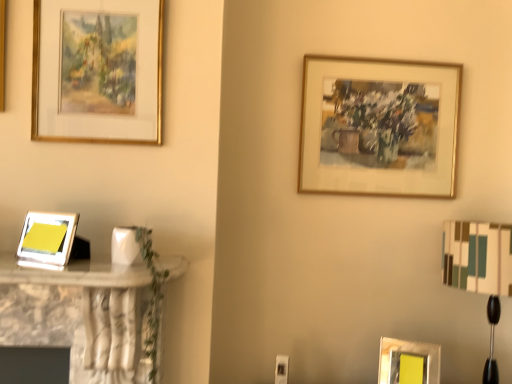
Question: Is gold metallic picture frame at upper right, the third picture frame from the bottom, outside of gold-framed painting at upper left, which appears as the second picture frame when viewed from the front?

Choices:
 (A) no
 (B) yes

Answer: (B)

Question: Is gold metallic picture frame at upper right, which is the 1th picture frame from back to front, aimed at gold-framed painting at upper left, which appears as the second picture frame when viewed from the front?

Choices:
 (A) yes
 (B) no

Answer: (B)

Question: Is gold metallic picture frame at upper right, the 3th picture frame viewed from the left, next to gold-framed painting at upper left, which appears as the second picture frame when viewed from the front?

Choices:
 (A) yes
 (B) no

Answer: (B)

Question: Is gold-framed painting at upper left, marked as the third picture frame in a back-to-front arrangement, completely or partially inside gold metallic picture frame at upper right, the 3th picture frame viewed from the left?

Choices:
 (A) no
 (B) yes

Answer: (A)

Question: Can you confirm if gold metallic picture frame at upper right, the third picture frame from the bottom, is thinner than gold-framed painting at upper left, the second picture frame viewed from the left?

Choices:
 (A) yes
 (B) no

Answer: (B)

Question: Visually, is matte silver picture frame at lower right, placed as the 1th picture frame when sorted from right to left, positioned to the left or to the right of matte silver picture frame at left, which appears as the fourth picture frame when viewed from the back?

Choices:
 (A) right
 (B) left

Answer: (A)

Question: Do you think matte silver picture frame at lower right, the third picture frame positioned from the front, is within matte silver picture frame at left, acting as the 1th picture frame starting from the front, or outside of it?

Choices:
 (A) outside
 (B) inside

Answer: (A)

Question: Is matte silver picture frame at lower right, arranged as the 4th picture frame when viewed from the left, taller or shorter than matte silver picture frame at left, the 2th picture frame ordered from the bottom?

Choices:
 (A) tall
 (B) short

Answer: (A)

Question: From a real-world perspective, relative to matte silver picture frame at left, the first picture frame viewed from the left, is matte silver picture frame at lower right, which is the 1th picture frame from bottom to top, vertically above or below?

Choices:
 (A) above
 (B) below

Answer: (B)

Question: Considering the positions of point (73, 6) and point (445, 231), is point (73, 6) closer or farther from the camera than point (445, 231)?

Choices:
 (A) closer
 (B) farther

Answer: (A)

Question: Based on their positions, is gold-framed painting at upper left, the 1th picture frame from the top, located to the left or right of white fabric lampshade at right?

Choices:
 (A) right
 (B) left

Answer: (B)

Question: Considering their positions, is gold-framed painting at upper left, the 1th picture frame from the top, located in front of or behind white fabric lampshade at right?

Choices:
 (A) front
 (B) behind

Answer: (A)

Question: Considering the positions of gold-framed painting at upper left, the fourth picture frame in the bottom-to-top sequence, and white fabric lampshade at right in the image, is gold-framed painting at upper left, the fourth picture frame in the bottom-to-top sequence, wider or thinner than white fabric lampshade at right?

Choices:
 (A) wide
 (B) thin

Answer: (B)

Question: Is gold metallic picture frame at upper right, which is the 1th picture frame from back to front, in front of or behind matte silver picture frame at lower right, positioned as the 2th picture frame in back-to-front order, in the image?

Choices:
 (A) behind
 (B) front

Answer: (A)

Question: In terms of width, does gold metallic picture frame at upper right, placed as the second picture frame when sorted from right to left, look wider or thinner when compared to matte silver picture frame at lower right, positioned as the 2th picture frame in back-to-front order?

Choices:
 (A) thin
 (B) wide

Answer: (A)